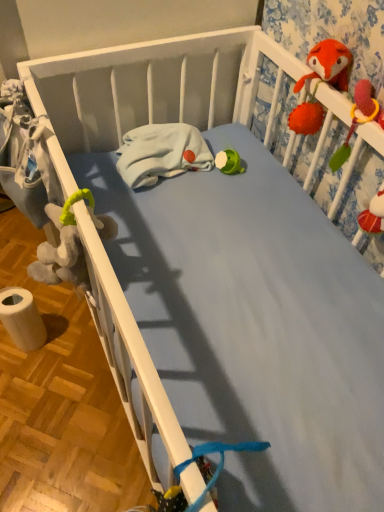
Question: Does white fleece blanket at center turn towards white paper towel at lower left?

Choices:
 (A) yes
 (B) no

Answer: (B)

Question: Can you confirm if white fleece blanket at center is smaller than white paper towel at lower left?

Choices:
 (A) no
 (B) yes

Answer: (B)

Question: Is white fleece blanket at center turned away from white paper towel at lower left?

Choices:
 (A) no
 (B) yes

Answer: (A)

Question: Does white fleece blanket at center have a larger size compared to white paper towel at lower left?

Choices:
 (A) yes
 (B) no

Answer: (B)

Question: Is white paper towel at lower left completely or partially inside white fleece blanket at center?

Choices:
 (A) no
 (B) yes

Answer: (A)

Question: From the image's perspective, is white fleece blanket at center positioned above or below white paper towel at lower left?

Choices:
 (A) above
 (B) below

Answer: (A)

Question: In the image, is white fleece blanket at center positioned in front of or behind white paper towel at lower left?

Choices:
 (A) behind
 (B) front

Answer: (B)

Question: Considering the positions of white fleece blanket at center and white paper towel at lower left in the image, is white fleece blanket at center bigger or smaller than white paper towel at lower left?

Choices:
 (A) big
 (B) small

Answer: (B)

Question: From a real-world perspective, is white fleece blanket at center physically located above or below white paper towel at lower left?

Choices:
 (A) above
 (B) below

Answer: (A)

Question: Considering the positions of soft plush toy at upper right and white fleece blanket at center in the image, is soft plush toy at upper right wider or thinner than white fleece blanket at center?

Choices:
 (A) wide
 (B) thin

Answer: (B)

Question: Considering the positions of soft plush toy at upper right and white fleece blanket at center in the image, is soft plush toy at upper right taller or shorter than white fleece blanket at center?

Choices:
 (A) short
 (B) tall

Answer: (B)

Question: Is point (365, 110) closer or farther from the camera than point (145, 154)?

Choices:
 (A) closer
 (B) farther

Answer: (A)

Question: Would you say soft plush toy at upper right is to the left or to the right of white fleece blanket at center in the picture?

Choices:
 (A) right
 (B) left

Answer: (A)

Question: From the image's perspective, is white paper towel at lower left above or below white fleece blanket at center?

Choices:
 (A) below
 (B) above

Answer: (A)

Question: Do you think white paper towel at lower left is within white fleece blanket at center, or outside of it?

Choices:
 (A) outside
 (B) inside

Answer: (A)